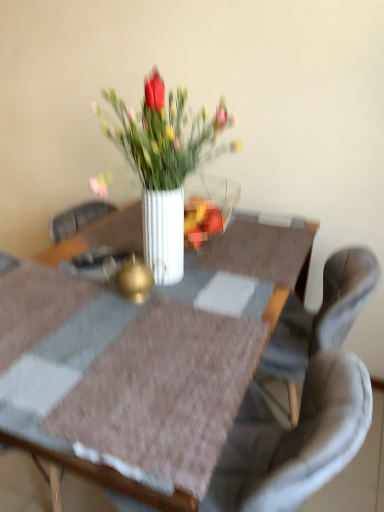
Identify the location of white glossy vase at center. (266, 257).

The width and height of the screenshot is (384, 512). What are the coordinates of `white glossy vase at center` in the screenshot? It's located at (x=207, y=208).

Describe the element at coordinates (294, 440) in the screenshot. The height and width of the screenshot is (512, 384). I see `gray fabric chair at center` at that location.

Find the location of a particular element. The image size is (384, 512). white glossy vase at center is located at coordinates (266, 257).

Identify the location of table below the white glossy vase at center (from the image's perspective). (266, 257).

Considering the sizes of white glossy vase at center and white glossy vase at center in the image, is white glossy vase at center bigger or smaller than white glossy vase at center?

Clearly, white glossy vase at center is smaller in size than white glossy vase at center.

From a real-world perspective, which object stands above the other?

white glossy vase at center is physically above.

Could you tell me if white glossy vase at center is turned towards white glossy vase at center?

No, white glossy vase at center is not facing towards white glossy vase at center.

Based on the photo, from the image's perspective, between white glossy vase at center and white glossy vase at center, who is located below?

white glossy vase at center, from the image's perspective.

From a real-world perspective, does white glossy vase at center stand above white glossy vase at center?

No, from a real-world perspective, white glossy vase at center is not over white glossy vase at center

Can you tell me how much white glossy vase at center and white glossy vase at center differ in facing direction?

The angle between the facing direction of white glossy vase at center and the facing direction of white glossy vase at center is 0.378 degrees.

The height and width of the screenshot is (512, 384). In the image, there is a white glossy vase at center. What are the coordinates of `chair below it (from a real-world perspective)` in the screenshot? It's located at (294, 440).

In terms of height, does gray fabric chair at center look taller or shorter compared to white glossy vase at center?

In the image, gray fabric chair at center appears to be shorter than white glossy vase at center.

Does gray fabric chair at center have a larger size compared to white glossy vase at center?

Incorrect, gray fabric chair at center is not larger than white glossy vase at center.

How distant is gray fabric chair at center from white glossy vase at center?

A distance of 30.69 centimeters exists between gray fabric chair at center and white glossy vase at center.

Does white glossy vase at center lie in front of gray fabric chair at center?

Yes, it is in front of gray fabric chair at center.

Looking at this image, is white glossy vase at center oriented towards gray fabric chair at center?

No, white glossy vase at center is not turned towards gray fabric chair at center.

Are white glossy vase at center and gray fabric chair at center far apart?

They are positioned close to each other.

Is gray fabric chair at center positioned beyond the bounds of white glossy vase at center?

Absolutely, gray fabric chair at center is external to white glossy vase at center.

Can you confirm if gray fabric chair at center is positioned to the left of white glossy vase at center?

In fact, gray fabric chair at center is to the right of white glossy vase at center.

Is gray fabric chair at center turned away from white glossy vase at center?

gray fabric chair at center does not have its back to white glossy vase at center.

Does gray fabric chair at center touch white glossy vase at center?

No, gray fabric chair at center is not beside white glossy vase at center.

Between white glossy vase at center and gray fabric chair at center, which one has larger size?

gray fabric chair at center.

Are white glossy vase at center and gray fabric chair at center beside each other?

No.

Considering the points (200, 210) and (333, 414), which point is behind, point (200, 210) or point (333, 414)?

Positioned behind is point (200, 210).

How distant is white glossy vase at center from gray fabric chair at center?

white glossy vase at center is 22.13 inches away from gray fabric chair at center.

Find the location of a particular element. The image size is (384, 512). table that is on the left side of white glossy vase at center is located at coordinates (266, 257).

Find the location of a particular element. table in front of the white glossy vase at center is located at coordinates (266, 257).

Which object lies further to the anchor point white glossy vase at center, white glossy vase at center or gray fabric chair at center?

gray fabric chair at center.

Estimate the real-world distances between objects in this image. Which object is further from white glossy vase at center, gray fabric chair at center or white glossy vase at center?

gray fabric chair at center is positioned further to the anchor white glossy vase at center.

Considering their positions, is gray fabric chair at center positioned further to white glossy vase at center than white glossy vase at center?

Based on the image, gray fabric chair at center appears to be further to white glossy vase at center.

Looking at the image, which one is located further to gray fabric chair at center, white glossy vase at center or white glossy vase at center?

Based on the image, white glossy vase at center appears to be further to gray fabric chair at center.

When comparing their distances from white glossy vase at center, does white glossy vase at center or gray fabric chair at center seem closer?

white glossy vase at center lies closer to white glossy vase at center than the other object.

Estimate the real-world distances between objects in this image. Which object is further from gray fabric chair at center, white glossy vase at center or white glossy vase at center?

white glossy vase at center is positioned further to the anchor gray fabric chair at center.

The image size is (384, 512). Identify the location of table that lies between white glossy vase at center and gray fabric chair at center from top to bottom. (266, 257).